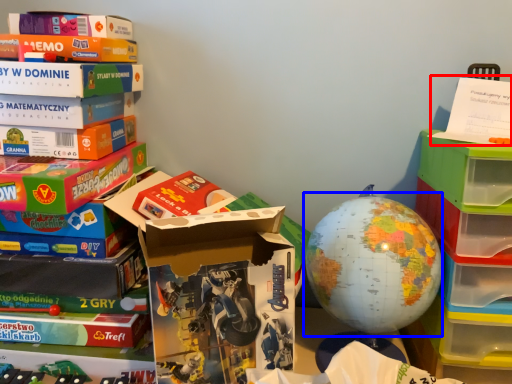
Question: Which object appears farthest to the camera in this image, paperback book (highlighted by a red box) or earth (highlighted by a blue box)?

Choices:
 (A) paperback book
 (B) earth

Answer: (B)